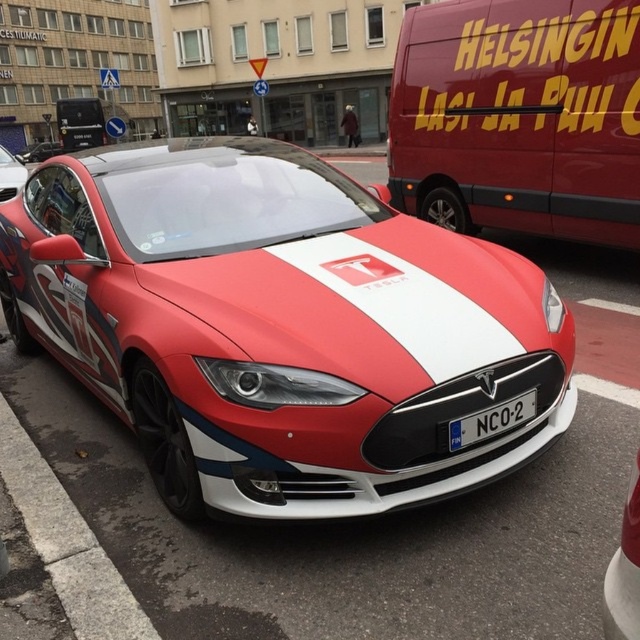
Question: Based on their relative distances, which object is nearer to the matte red van at upper right?

Choices:
 (A) shiny red tesla at center
 (B) shiny red and white tesla at center

Answer: (A)

Question: Which object is farther from the camera taking this photo?

Choices:
 (A) shiny red tesla at center
 (B) white plastic license plate at center
 (C) matte red and white tesla at center

Answer: (A)

Question: Estimate the real-world distances between objects in this image. Which object is farther from the shiny red tesla at center?

Choices:
 (A) matte red van at upper right
 (B) white plastic license plate at center

Answer: (B)

Question: Does matte red and white tesla at center have a larger size compared to shiny red tesla at center?

Choices:
 (A) yes
 (B) no

Answer: (B)

Question: Does matte red van at upper right have a smaller size compared to shiny red tesla at center?

Choices:
 (A) no
 (B) yes

Answer: (B)

Question: Where is white plastic license plate at center located in relation to shiny red and white tesla at center in the image?

Choices:
 (A) left
 (B) right

Answer: (B)